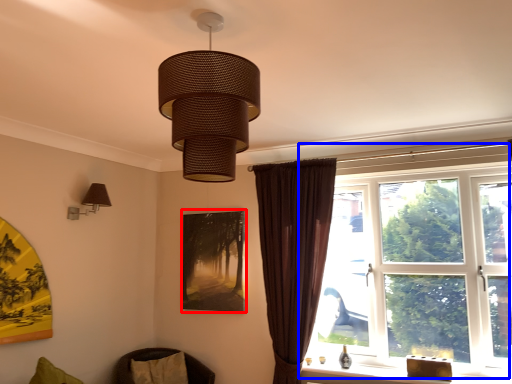
Question: Which of the following is the farthest to the observer, picture frame (highlighted by a red box) or window (highlighted by a blue box)?

Choices:
 (A) picture frame
 (B) window

Answer: (A)